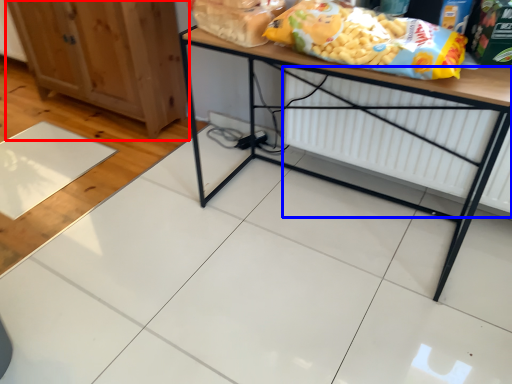
Question: Which object is closer to the camera taking this photo, cabinetry (highlighted by a red box) or radiator (highlighted by a blue box)?

Choices:
 (A) cabinetry
 (B) radiator

Answer: (B)